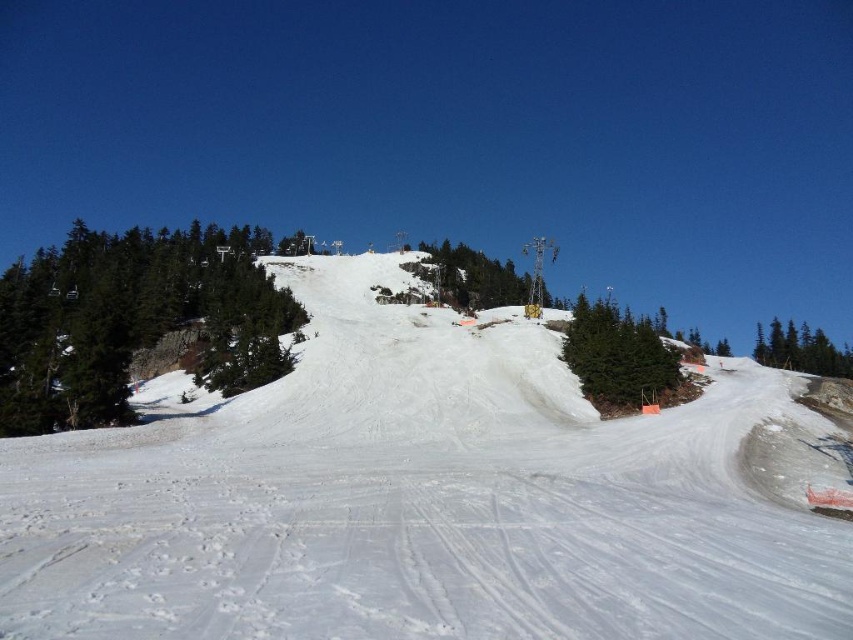
Question: Does yellow metallic tower at center lie behind green matte tree at right?

Choices:
 (A) no
 (B) yes

Answer: (B)

Question: Does green matte tree at left appear on the left side of green matte tree at right?

Choices:
 (A) no
 (B) yes

Answer: (B)

Question: Among these objects, which one is farthest from the camera?

Choices:
 (A) yellow metallic tower at center
 (B) white powdery snow at center

Answer: (A)

Question: Where is green matte tree at center located in relation to green matte tree at right in the image?

Choices:
 (A) left
 (B) right

Answer: (A)

Question: Estimate the real-world distances between objects in this image. Which object is closer to the white powdery snow at center?

Choices:
 (A) yellow metallic tower at center
 (B) green matte tree at right
 (C) green matte tree at center

Answer: (C)

Question: Which object is the closest to the green matte tree at left?

Choices:
 (A) white powdery snow at center
 (B) green matte tree at right
 (C) yellow metallic tower at center

Answer: (A)